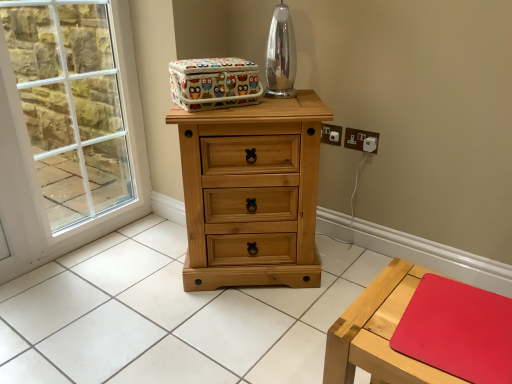
You are a GUI agent. You are given a task and a screenshot of the screen. Output one action in this format:
    pyautogui.click(x=<x>, y=<y>)
    Task: Click on the free space in front of natural wood chest of drawers at center
    Image resolution: width=512 pixels, height=384 pixels.
    Given the screenshot: What is the action you would take?
    pyautogui.click(x=237, y=328)